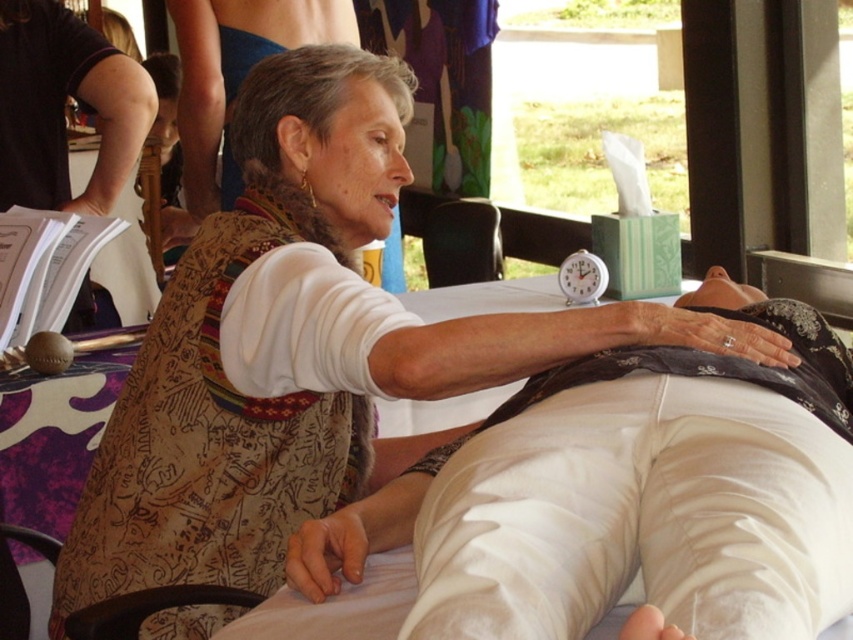
You are a person who wants to pick up the white plastic alarm clock at upper center from where you are standing next to the white cotton pants at center. Can you reach it without moving your feet?

The white cotton pants at center and white plastic alarm clock at upper center are 4.91 feet apart. Since 4.91 feet is approximately 59 inches, which is beyond the typical human arm reach of around 24 to 30 inches, you cannot reach the white plastic alarm clock at upper center without moving your feet.

Based on the scene description, where is the white cotton pants at center located in the image?

The white cotton pants at center is located at point [608,506].

You are organizing a workshop and need to place a white plastic alarm clock at upper center on top of the white cotton pants at center. Will the alarm clock fit on the pants without hanging off?

The white cotton pants at center is bigger than the white plastic alarm clock at upper center, so the alarm clock will fit on the pants without hanging off.